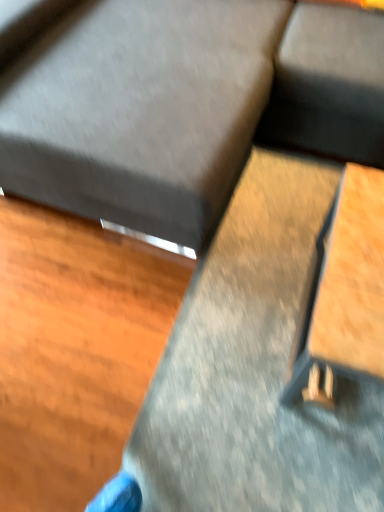
Locate an element on the screen. This screenshot has height=512, width=384. blank space situated above textured gray concrete at center (from a real-world perspective) is located at coordinates (270, 329).